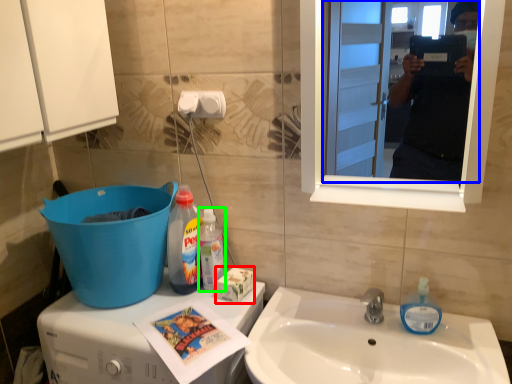
Question: Considering the real-world distances, which object is farthest from box (highlighted by a red box)? mirror (highlighted by a blue box) or bottle (highlighted by a green box)?

Choices:
 (A) mirror
 (B) bottle

Answer: (A)